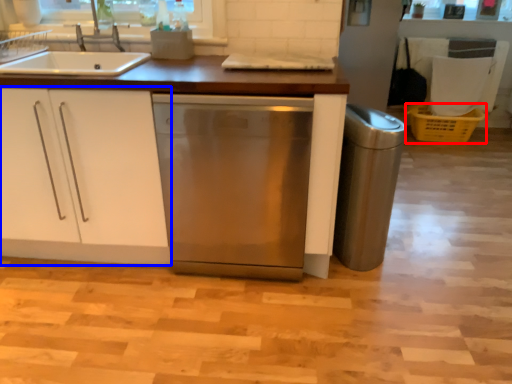
Question: Which of the following is the farthest to the observer, crate (highlighted by a red box) or cabinetry (highlighted by a blue box)?

Choices:
 (A) crate
 (B) cabinetry

Answer: (A)